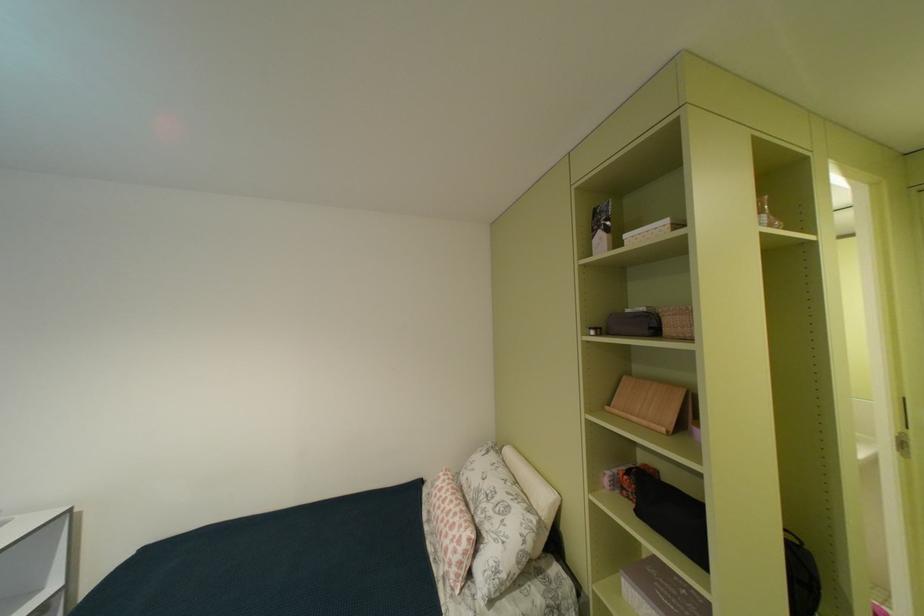
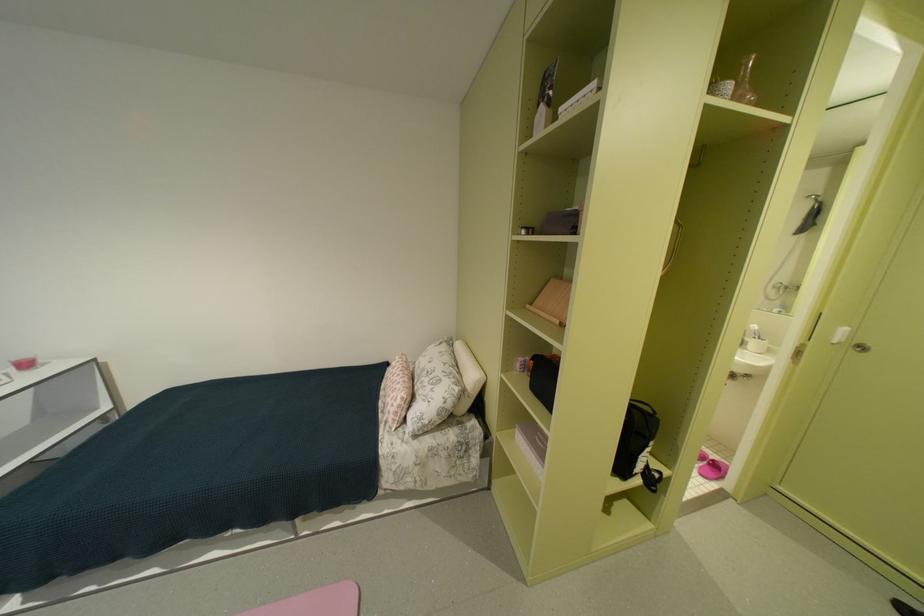
Question: Which direction would the cameraman need to move to produce the second image? Reply with the corresponding letter.

Choices:
 (A) Left
 (B) Right
 (C) Forward
 (D) Backward

Answer: (B)